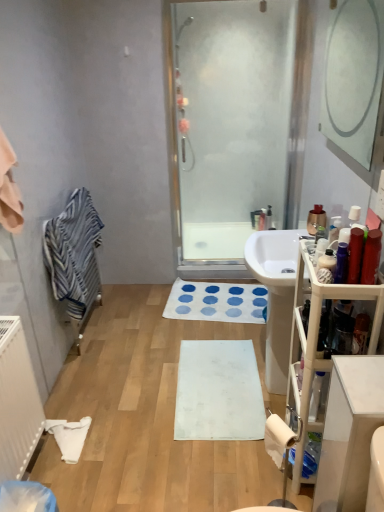
You are a GUI agent. You are given a task and a screenshot of the screen. Output one action in this format:
    pyautogui.click(x=<x>, y=<y>)
    Task: Click on the empty space that is ontop of white matte bath mat at center, the second bath mat viewed from the top
    The image size is (384, 512).
    Given the screenshot: What is the action you would take?
    pyautogui.click(x=215, y=385)